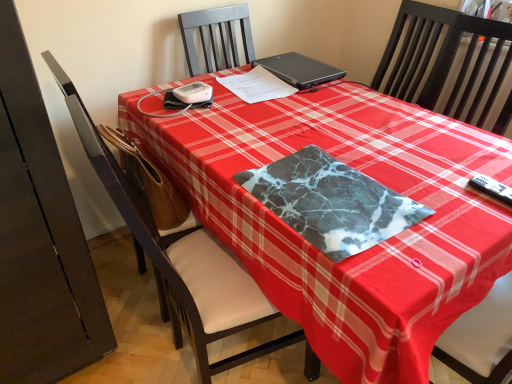
Locate an element on the screen. Image resolution: width=512 pixels, height=384 pixels. vacant space situated above marble-like fabric at center (from a real-world perspective) is located at coordinates (326, 188).